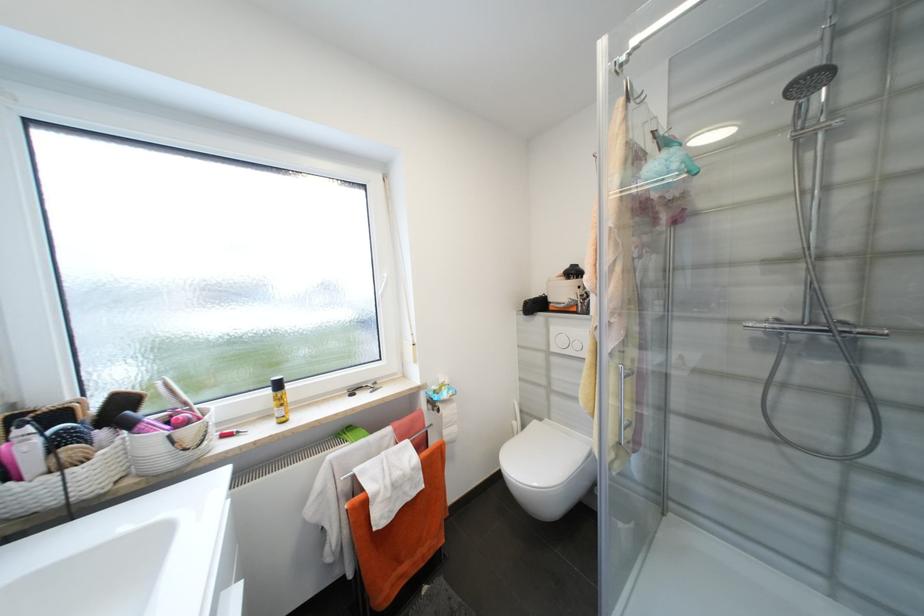
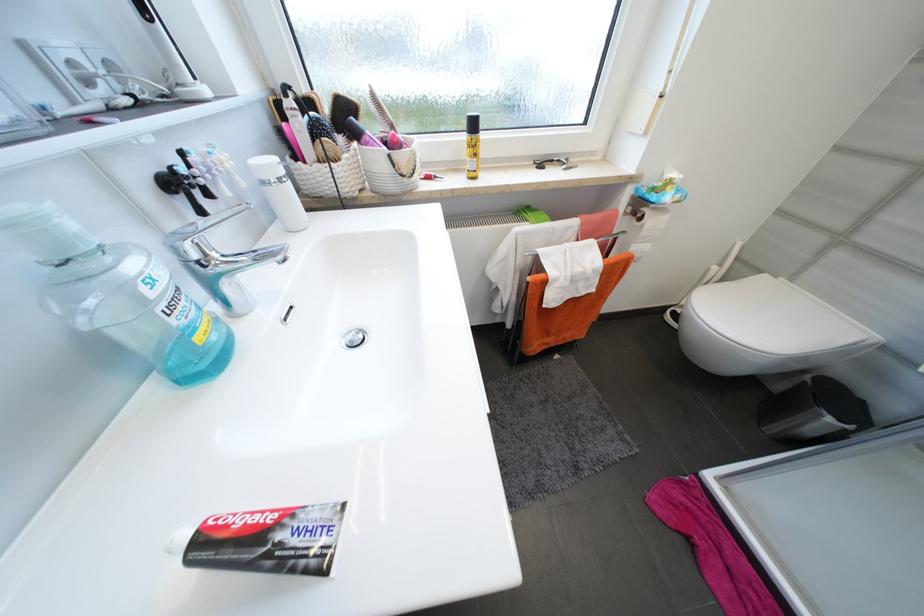
Locate, in the second image, the point that corresponds to [541,422] in the first image.

(771, 277)